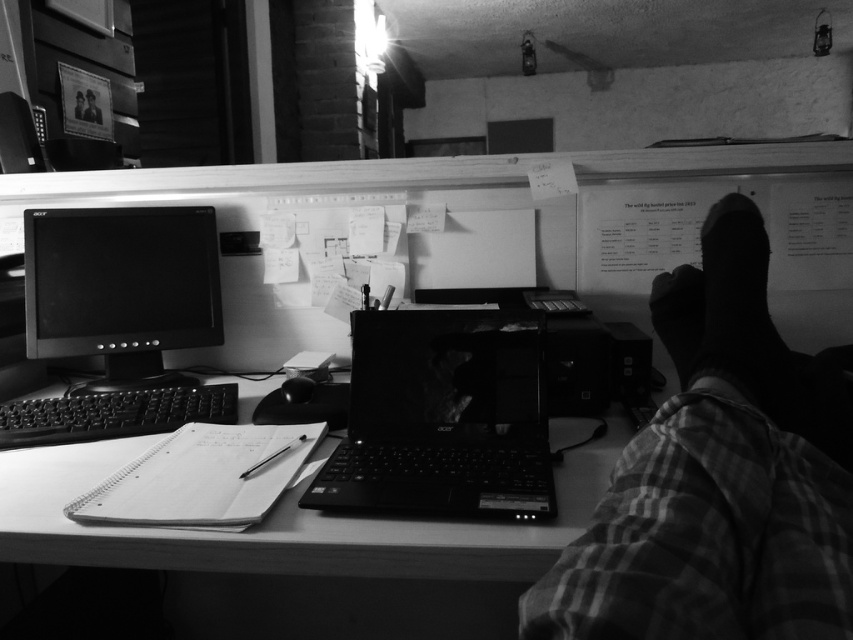
Who is higher up, matte black monitor at left or smooth skin foot at lower right?

matte black monitor at left

Is matte black monitor at left behind smooth skin foot at lower right?

Yes, matte black monitor at left is behind smooth skin foot at lower right.

Who is more distant from viewer, (109, 371) or (665, 324)?

Point (109, 371)

Locate an element on the screen. This screenshot has height=640, width=853. matte black monitor at left is located at coordinates (120, 289).

Who is taller, shiny black laptop at center or smooth skin foot at lower right?

shiny black laptop at center

Can you confirm if shiny black laptop at center is shorter than smooth skin foot at lower right?

In fact, shiny black laptop at center may be taller than smooth skin foot at lower right.

Who is more distant from viewer, (x=515, y=368) or (x=693, y=269)?

Positioned behind is point (x=515, y=368).

Locate an element on the screen. The width and height of the screenshot is (853, 640). shiny black laptop at center is located at coordinates (442, 417).

Does point (715, 493) come closer to viewer compared to point (175, 403)?

Yes, point (715, 493) is in front of point (175, 403).

Who is lower down, plaid fabric leg at right or black plastic keyboard at lower left?

black plastic keyboard at lower left

Identify the location of plaid fabric leg at right. This screenshot has height=640, width=853. (718, 476).

The height and width of the screenshot is (640, 853). Identify the location of plaid fabric leg at right. (718, 476).